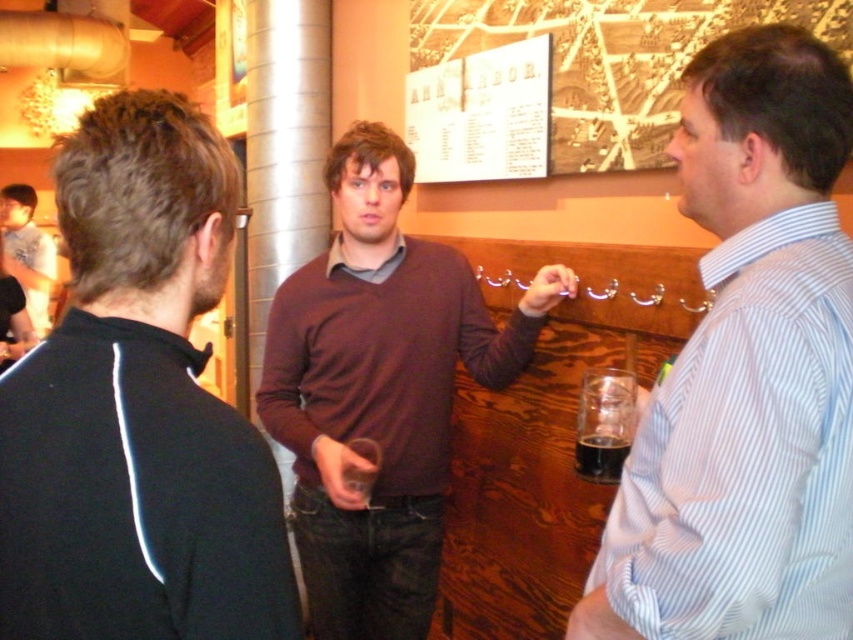
Question: Which point is closer to the camera taking this photo?

Choices:
 (A) (349, 394)
 (B) (160, 600)
 (C) (599, 474)

Answer: (B)

Question: Which point is farther from the camera taking this photo?

Choices:
 (A) (387, 422)
 (B) (33, 317)
 (C) (611, 458)
 (D) (614, 397)

Answer: (B)

Question: Is black matte jacket at left wider than dark glassy beverage at lower right?

Choices:
 (A) no
 (B) yes

Answer: (B)

Question: Can you confirm if white striped shirt at right is positioned to the right of matte black shirt at left?

Choices:
 (A) no
 (B) yes

Answer: (B)

Question: Which object appears farthest from the camera in this image?

Choices:
 (A) maroon sweater at center
 (B) transparent glass at center

Answer: (A)

Question: Does transparent glass at center appear on the right side of matte black shirt at left?

Choices:
 (A) no
 (B) yes

Answer: (B)